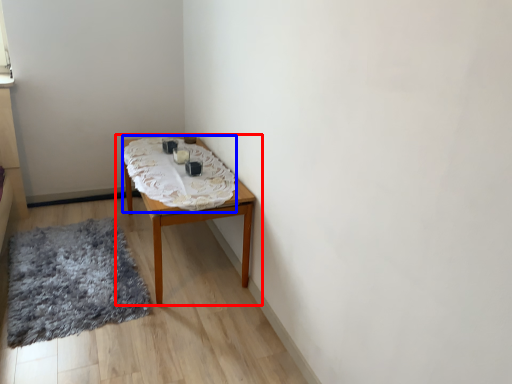
Question: Among these objects, which one is nearest to the camera, table (highlighted by a red box) or blanket (highlighted by a blue box)?

Choices:
 (A) table
 (B) blanket

Answer: (B)